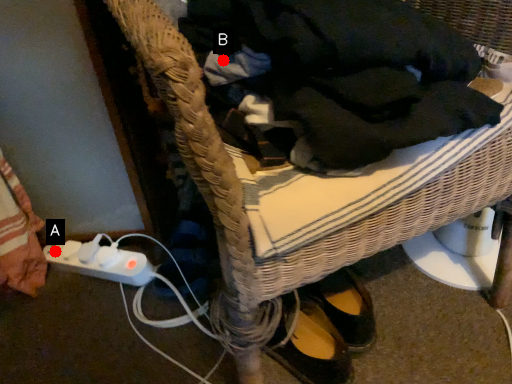
Question: Two points are circled on the image, labeled by A and B beside each circle. Which point is closer to the camera taking this photo?

Choices:
 (A) A is closer
 (B) B is closer

Answer: (B)